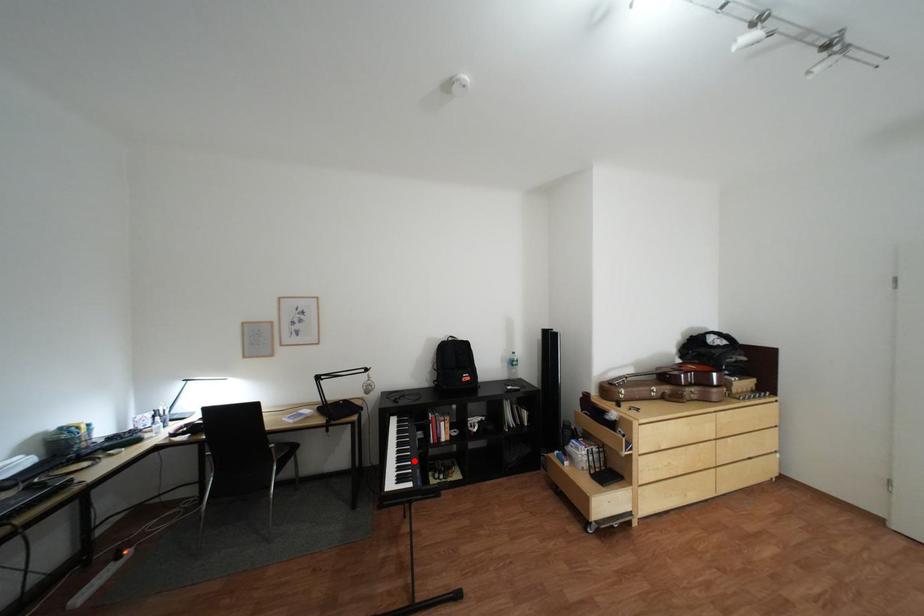
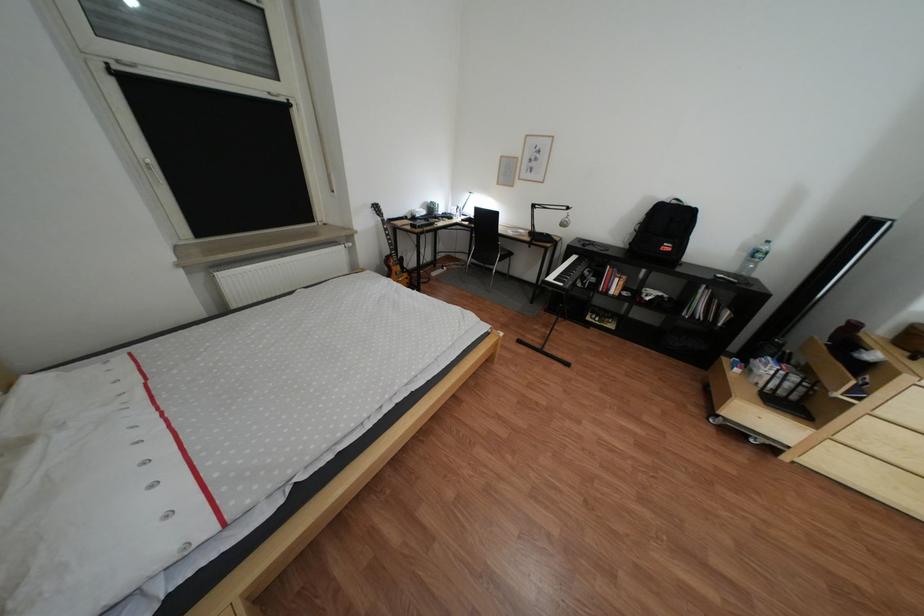
Question: I am providing you with two images of the same scene from different viewpoints. A red point is marked on the first image. Is the red point's position out of view in image 2?

Choices:
 (A) Yes
 (B) No

Answer: (B)